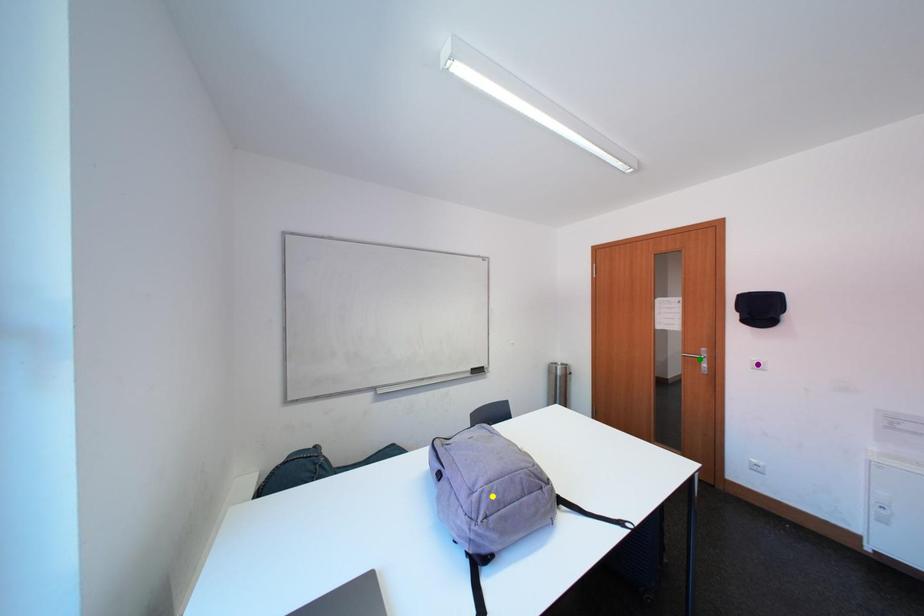
Order these from nearest to farthest:
purple point, green point, yellow point

yellow point, purple point, green point